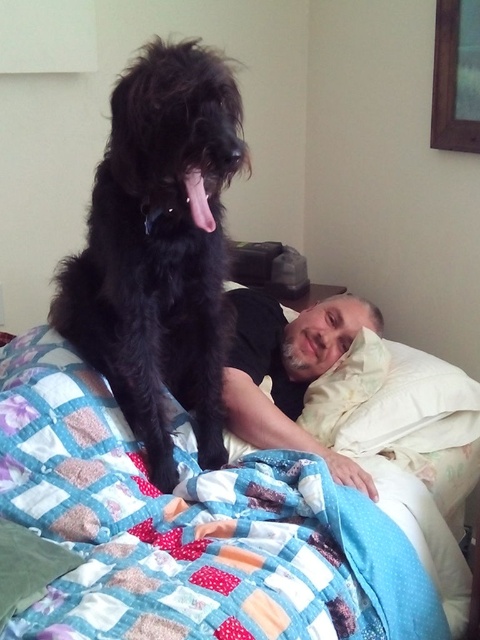
Question: Is black fluffy dog at upper left wider than white soft pillow at upper right?

Choices:
 (A) yes
 (B) no

Answer: (B)

Question: Which object is the farthest from the black fluffy dog at upper left?

Choices:
 (A) quilted fabric bed at upper left
 (B) white soft pillow at upper right

Answer: (B)

Question: Which object appears closest to the camera in this image?

Choices:
 (A) black fluffy dog at upper left
 (B) quilted fabric bed at upper left
 (C) white soft pillow at upper right

Answer: (B)

Question: Does quilted fabric bed at upper left have a greater width compared to white soft pillow at upper right?

Choices:
 (A) no
 (B) yes

Answer: (B)

Question: Which is farther from the white soft pillow at upper right?

Choices:
 (A) quilted fabric bed at upper left
 (B) black fluffy dog at upper left

Answer: (B)

Question: Can you confirm if quilted fabric bed at upper left is smaller than black fluffy dog at upper left?

Choices:
 (A) no
 (B) yes

Answer: (A)